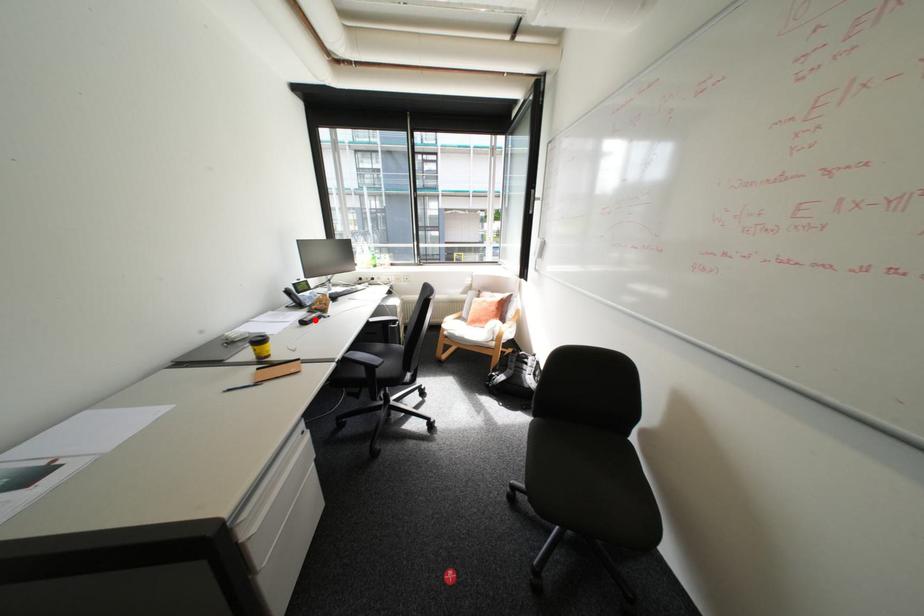
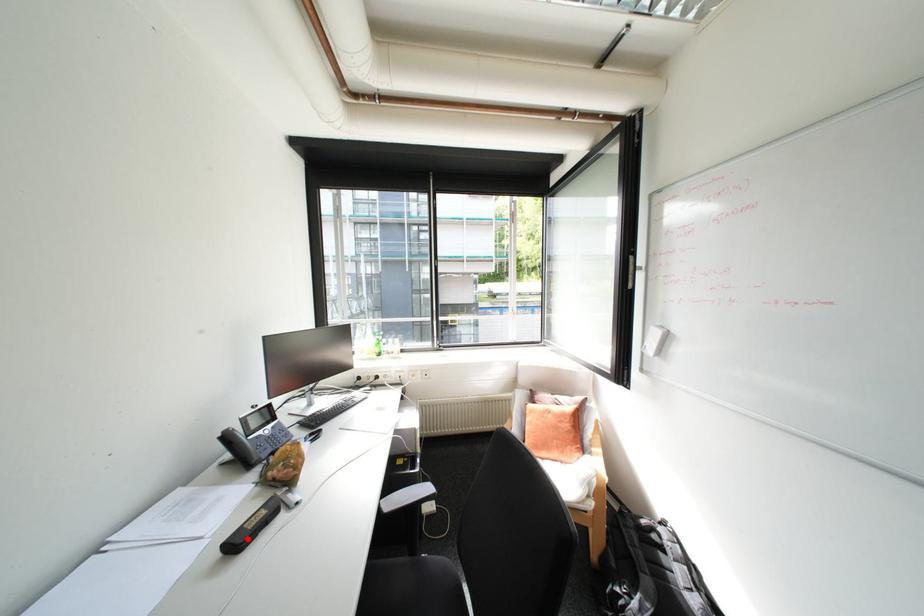
I am providing you with two images of the same scene from different viewpoints. A red point is marked on the first image and another point is marked on the second image. Does the point marked in image1 correspond to the same location as the one in image2?

Yes